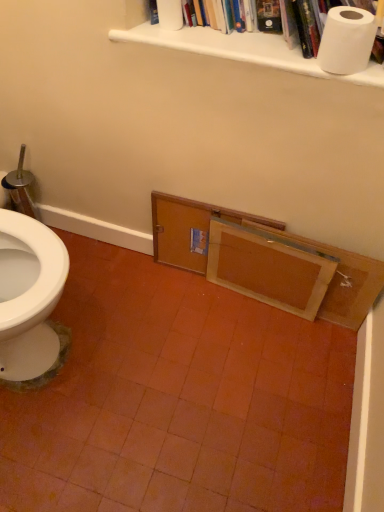
Question: Should I look upward or downward to see wooden cabinet at lower right?

Choices:
 (A) down
 (B) up

Answer: (B)

Question: From a real-world perspective, is wooden drawer at center, which is the 1th drawer from right to left, below white matte toilet paper at upper center, the second toilet paper positioned from the front?

Choices:
 (A) no
 (B) yes

Answer: (B)

Question: Is wooden drawer at center, which is the 1th drawer from right to left, positioned far away from white matte toilet paper at upper center, which is the first toilet paper from top to bottom?

Choices:
 (A) no
 (B) yes

Answer: (A)

Question: Is wooden drawer at center, the second drawer from the left, to the left of white matte toilet paper at upper center, which is the first toilet paper from top to bottom, from the viewer's perspective?

Choices:
 (A) no
 (B) yes

Answer: (A)

Question: From the image's perspective, would you say wooden drawer at center, which is the 1th drawer from right to left, is positioned over white matte toilet paper at upper center, marked as the 2th toilet paper in a bottom-to-top arrangement?

Choices:
 (A) yes
 (B) no

Answer: (B)

Question: Considering the relative sizes of wooden drawer at center, which is the 1th drawer from right to left, and white matte toilet paper at upper center, which is the first toilet paper from top to bottom, in the image provided, is wooden drawer at center, which is the 1th drawer from right to left, smaller than white matte toilet paper at upper center, which is the first toilet paper from top to bottom,?

Choices:
 (A) no
 (B) yes

Answer: (A)

Question: Can you confirm if wooden drawer at center, the second drawer from the left, is bigger than white matte toilet paper at upper center, which appears as the 1th toilet paper when viewed from the left?

Choices:
 (A) no
 (B) yes

Answer: (B)

Question: Is white matte toilet paper at upper right, the first toilet paper positioned from the front, aimed at wooden drawer at lower center, which is counted as the 2th drawer, starting from the right?

Choices:
 (A) yes
 (B) no

Answer: (B)

Question: From a real-world perspective, is white matte toilet paper at upper right, which ranks as the 2th toilet paper in back-to-front order, under wooden drawer at lower center, the 1th drawer positioned from the left?

Choices:
 (A) no
 (B) yes

Answer: (A)

Question: Is white matte toilet paper at upper right, which ranks as the 2th toilet paper in back-to-front order, wider than wooden drawer at lower center, which is counted as the 2th drawer, starting from the right?

Choices:
 (A) no
 (B) yes

Answer: (B)

Question: Is white matte toilet paper at upper right, placed as the 2th toilet paper when sorted from left to right, behind wooden drawer at lower center, which is counted as the 2th drawer, starting from the right?

Choices:
 (A) yes
 (B) no

Answer: (B)

Question: Is white matte toilet paper at upper right, placed as the 2th toilet paper when sorted from left to right, taller than wooden drawer at lower center, which is counted as the 2th drawer, starting from the right?

Choices:
 (A) yes
 (B) no

Answer: (B)

Question: From a real-world perspective, is white matte toilet paper at upper right, placed as the 2th toilet paper when sorted from left to right, on wooden drawer at lower center, which is counted as the 2th drawer, starting from the right?

Choices:
 (A) no
 (B) yes

Answer: (B)